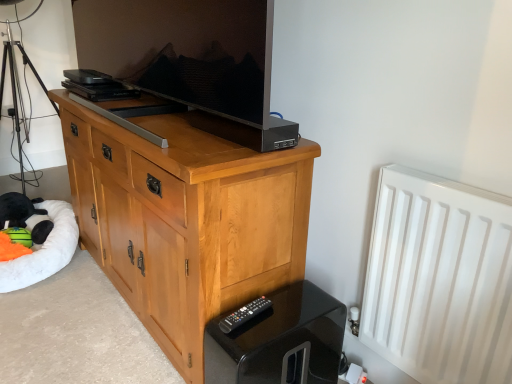
You are a GUI agent. You are given a task and a screenshot of the screen. Output one action in this format:
    pyautogui.click(x=<x>, y=<y>)
    Task: Click on the free space above black glossy remote control at lower right (from a real-world perspective)
    The height and width of the screenshot is (384, 512).
    Given the screenshot: What is the action you would take?
    [248, 314]